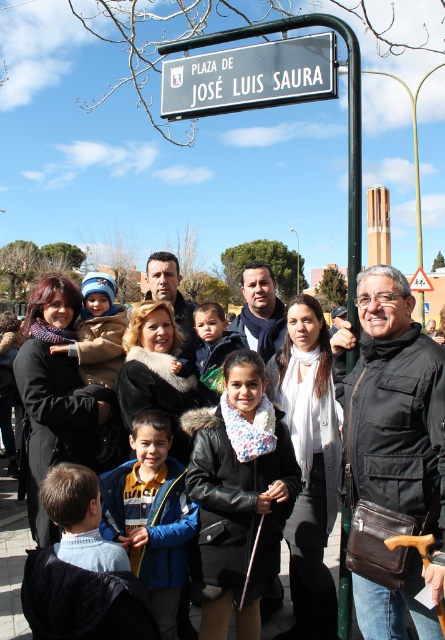
You are a photographer trying to capture a group photo. You notice the black leather jacket at center and the light brown hair at center. Which object is positioned lower in the image?

The black leather jacket at center is positioned below the light brown hair at center, so it is lower in the image.

Consider the image. You are standing in front of the group of people in the image. You notice two points marked on the scene. The first point is at coordinates point [385,324] and the second is at point [331,88]. Which of these two points is closer to you?

Point [385,324] is closer to you than point [331,88].